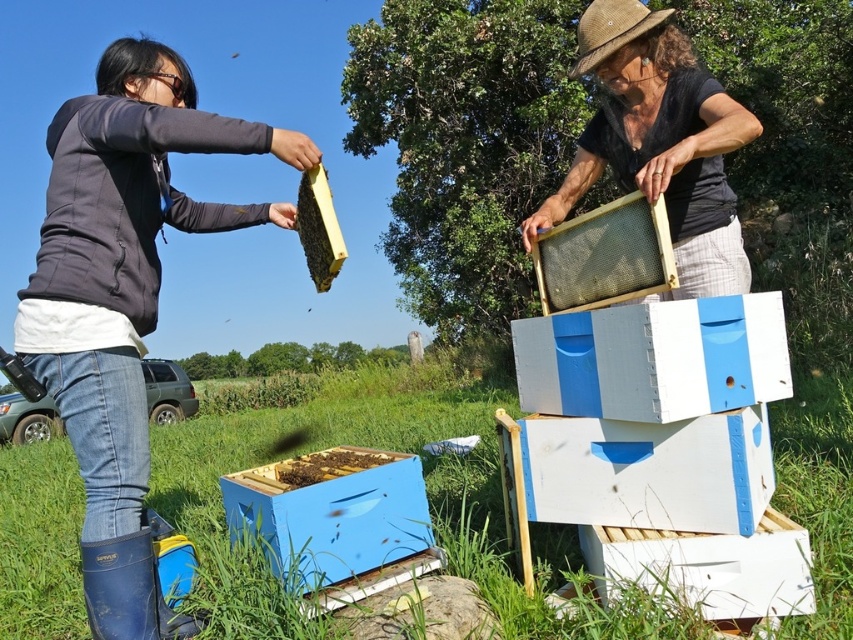
Question: Which object is closer to the camera taking this photo?

Choices:
 (A) blue painted wooden beehive at lower center
 (B) matte black frame at center

Answer: (B)

Question: Which object is positioned farthest from the matte black jacket at left?

Choices:
 (A) blue painted wooden beehive at lower center
 (B) black wax comb at upper center
 (C) matte black frame at center
 (D) wooden frame at center

Answer: (C)

Question: Is matte black jacket at left above wooden frame at center?

Choices:
 (A) no
 (B) yes

Answer: (A)

Question: Which is nearer to the wooden frame at center?

Choices:
 (A) matte black jacket at left
 (B) blue painted wooden beehive at lower center
 (C) matte black frame at center

Answer: (C)

Question: Can you confirm if matte black frame at center is smaller than blue painted wooden beehive at lower center?

Choices:
 (A) yes
 (B) no

Answer: (B)

Question: Does matte black jacket at left have a lesser width compared to matte black frame at center?

Choices:
 (A) yes
 (B) no

Answer: (B)